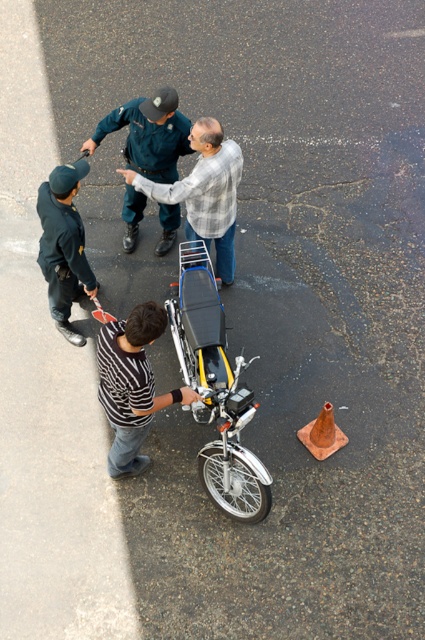
Who is lower down, striped fabric shirt at center or dark blue uniform at left?

Positioned lower is striped fabric shirt at center.

Is point (110, 374) farther from viewer compared to point (65, 292)?

No.

Where is `striped fabric shirt at center`? The width and height of the screenshot is (425, 640). striped fabric shirt at center is located at coordinates (132, 385).

Can you confirm if black matte motorcycle at center is taller than dark blue uniform at left?

Yes, black matte motorcycle at center is taller than dark blue uniform at left.

Which is in front, point (172, 301) or point (42, 189)?

Point (42, 189) is more forward.

Describe the element at coordinates (215, 388) in the screenshot. I see `black matte motorcycle at center` at that location.

At what (x,y) coordinates should I click in order to perform the action: click on black matte motorcycle at center. Please return your answer as a coordinate pair (x, y). The image size is (425, 640). Looking at the image, I should click on (215, 388).

Does black matte motorcycle at center have a lesser height compared to dark blue uniform at upper center?

No.

Does black matte motorcycle at center appear on the right side of dark blue uniform at upper center?

Yes, black matte motorcycle at center is to the right of dark blue uniform at upper center.

Is point (232, 396) positioned behind point (150, 170)?

No, it is not.

Locate an element on the screen. black matte motorcycle at center is located at coordinates (215, 388).